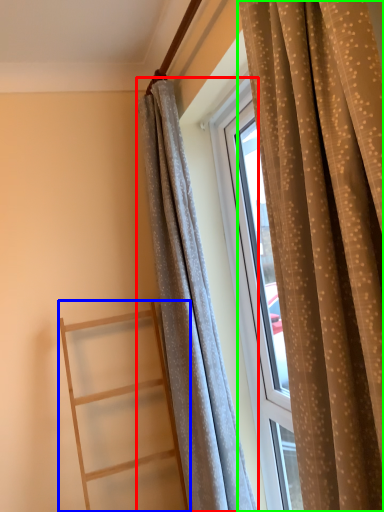
Question: Considering the real-world distances, which object is farthest from curtain (highlighted by a red box)? ladder (highlighted by a blue box) or curtain (highlighted by a green box)?

Choices:
 (A) ladder
 (B) curtain

Answer: (B)